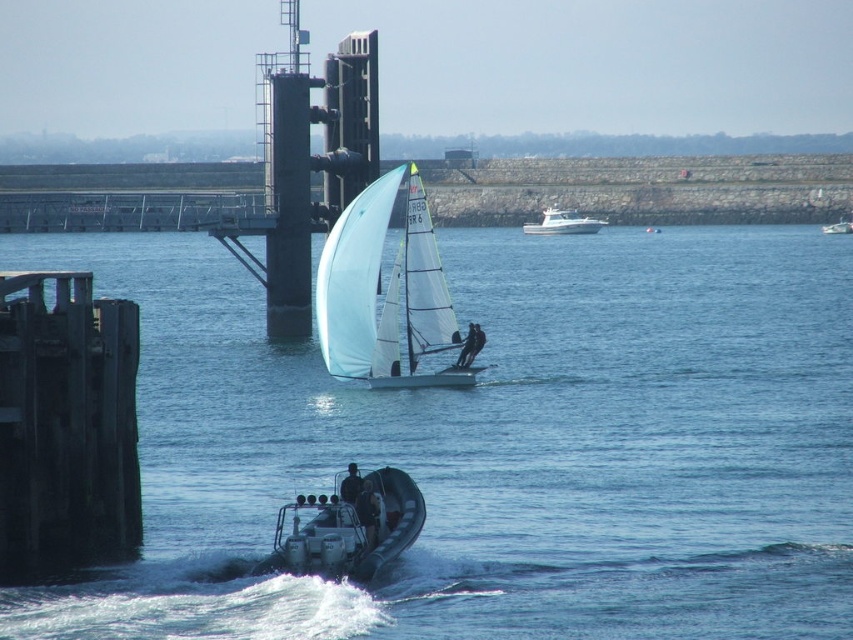
Question: Can you confirm if white glossy boat at upper center is smaller than black fabric jacket at lower center?

Choices:
 (A) no
 (B) yes

Answer: (A)

Question: Does white glossy boat at upper center appear over smooth white sail at center?

Choices:
 (A) yes
 (B) no

Answer: (A)

Question: Considering the real-world distances, which object is closest to the blue water at center?

Choices:
 (A) white plastic boat at center
 (B) rubber boat at lower center
 (C) black fabric sailboat at center

Answer: (B)

Question: Which object is positioned farthest from the black fabric jacket at lower center?

Choices:
 (A) white plastic boat at center
 (B) dark blue fabric jacket at lower center
 (C) smooth white sail at center

Answer: (A)

Question: Which point is closer to the camera?

Choices:
 (A) smooth white sail at center
 (B) rubber boat at lower center

Answer: (B)

Question: Can you confirm if black fabric jacket at lower center is positioned to the right of white plastic boat at center?

Choices:
 (A) yes
 (B) no

Answer: (B)